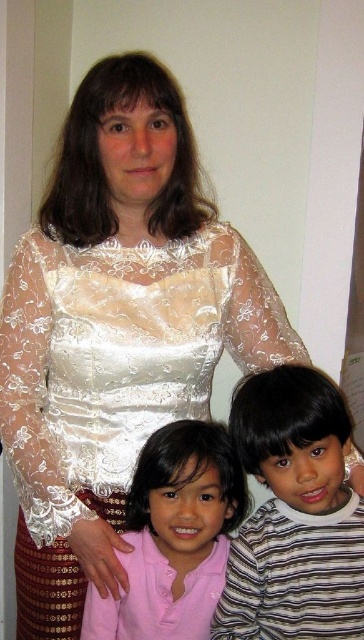
Does striped cotton shirt at lower center have a larger size compared to pink satin shirt at lower left?

Indeed, striped cotton shirt at lower center has a larger size compared to pink satin shirt at lower left.

Does striped cotton shirt at lower center lie behind pink satin shirt at lower left?

No, it is not.

Does point (359, 536) come behind point (227, 440)?

That is False.

At what (x,y) coordinates should I click in order to perform the action: click on striped cotton shirt at lower center. Please return your answer as a coordinate pair (x, y). Looking at the image, I should click on (294, 515).